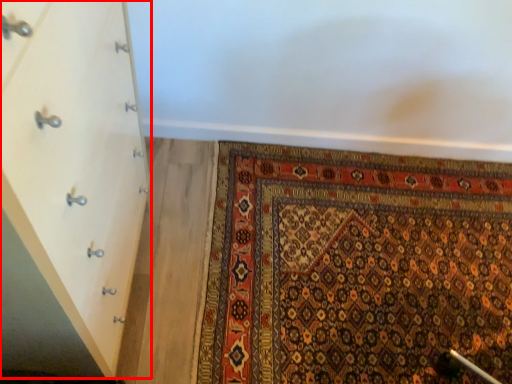
Question: Considering the relative positions of chest of drawers (annotated by the red box) and mat in the image provided, where is chest of drawers (annotated by the red box) located with respect to the staircase?

Choices:
 (A) left
 (B) right

Answer: (A)